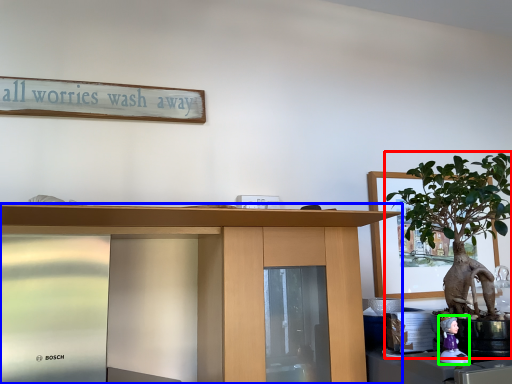
Question: Based on their relative distances, which object is nearer to houseplant (highlighted by a red box)? Choose from desk (highlighted by a blue box) and toy (highlighted by a green box).

Choices:
 (A) desk
 (B) toy

Answer: (B)